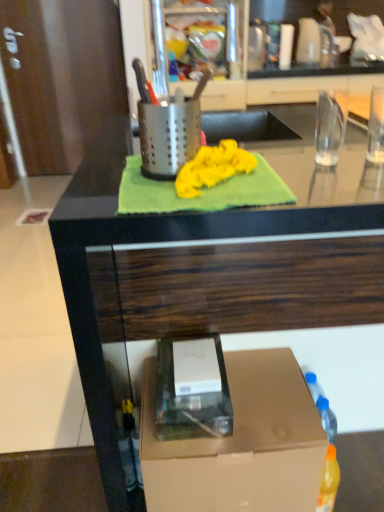
Question: From the image's perspective, is green fabric at upper center positioned above or below yellow fabric at center?

Choices:
 (A) below
 (B) above

Answer: (A)

Question: Visually, is green fabric at upper center positioned to the left or to the right of yellow fabric at center?

Choices:
 (A) left
 (B) right

Answer: (B)

Question: Which of these objects is positioned farthest from the green fabric at upper center?

Choices:
 (A) brown cardboard box at lower right
 (B) yellow fabric at center
 (C) yellow fabric at center

Answer: (B)

Question: Which is farther from the yellow fabric at center?

Choices:
 (A) yellow fabric at center
 (B) green fabric at upper center
 (C) brown cardboard box at lower right

Answer: (C)